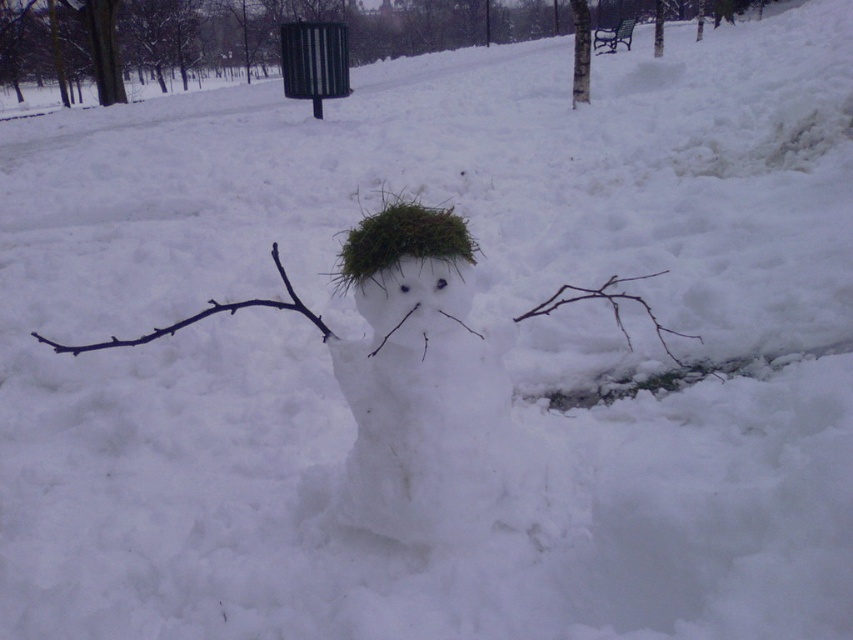
Between point (360, 248) and point (672, 358), which one is positioned behind?

Positioned behind is point (672, 358).

Who is higher up, white fluffy snowman at center or brown twig at lower right?

Positioned higher is brown twig at lower right.

Is point (460, 296) closer to camera compared to point (695, 339)?

Yes.

Locate an element on the screen. This screenshot has width=853, height=640. white fluffy snowman at center is located at coordinates (419, 380).

Looking at this image, does brown/rough branch at left have a larger size compared to brown twig at lower right?

No, brown/rough branch at left is not bigger than brown twig at lower right.

Does brown/rough branch at left have a greater height compared to brown twig at lower right?

No, brown/rough branch at left is not taller than brown twig at lower right.

Is point (170, 333) positioned after point (654, 324)?

That is False.

Where is `brown/rough branch at left`? Image resolution: width=853 pixels, height=640 pixels. brown/rough branch at left is located at coordinates (204, 316).

Consider the image. Is white fluffy snowman at center further to camera compared to brown/rough branch at left?

No, white fluffy snowman at center is in front of brown/rough branch at left.

Is white fluffy snowman at center thinner than brown/rough branch at left?

Correct, white fluffy snowman at center's width is less than brown/rough branch at left's.

At what (x,y) coordinates should I click in order to perform the action: click on white fluffy snowman at center. Please return your answer as a coordinate pair (x, y). Image resolution: width=853 pixels, height=640 pixels. Looking at the image, I should click on (419, 380).